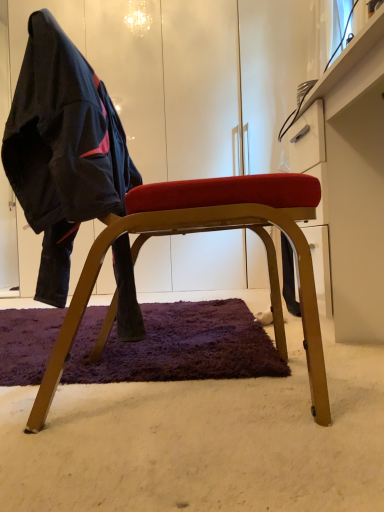
Question: Is wooden chair at center oriented towards white glossy dresser at upper right?

Choices:
 (A) no
 (B) yes

Answer: (B)

Question: From the image's perspective, is wooden chair at center on white glossy dresser at upper right?

Choices:
 (A) no
 (B) yes

Answer: (A)

Question: Considering the relative positions of wooden chair at center and white glossy dresser at upper right in the image provided, is wooden chair at center to the left of white glossy dresser at upper right from the viewer's perspective?

Choices:
 (A) no
 (B) yes

Answer: (B)

Question: Is wooden chair at center completely or partially outside of white glossy dresser at upper right?

Choices:
 (A) yes
 (B) no

Answer: (A)

Question: Is wooden chair at center shorter than white glossy dresser at upper right?

Choices:
 (A) yes
 (B) no

Answer: (B)

Question: From the image's perspective, would you say wooden chair at center is shown under white glossy dresser at upper right?

Choices:
 (A) no
 (B) yes

Answer: (B)

Question: From the image's perspective, is matte black jacket at left on white glossy dresser at upper right?

Choices:
 (A) no
 (B) yes

Answer: (B)

Question: Is the depth of matte black jacket at left less than that of white glossy dresser at upper right?

Choices:
 (A) no
 (B) yes

Answer: (B)

Question: Does matte black jacket at left have a greater width compared to white glossy dresser at upper right?

Choices:
 (A) no
 (B) yes

Answer: (A)

Question: From a real-world perspective, is matte black jacket at left physically above white glossy dresser at upper right?

Choices:
 (A) no
 (B) yes

Answer: (B)

Question: Is white glossy dresser at upper right completely or partially inside matte black jacket at left?

Choices:
 (A) yes
 (B) no

Answer: (B)

Question: From the image's perspective, does matte black jacket at left appear lower than white glossy dresser at upper right?

Choices:
 (A) no
 (B) yes

Answer: (A)

Question: Is wooden chair at center located within matte black jacket at left?

Choices:
 (A) yes
 (B) no

Answer: (A)